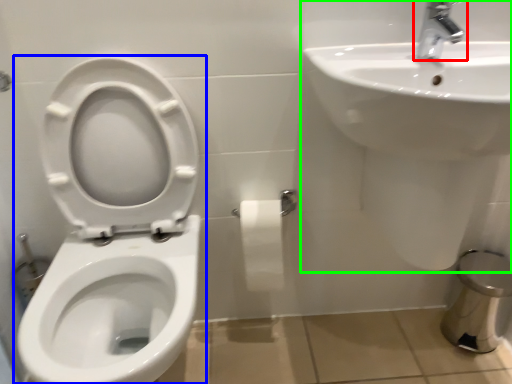
Question: Estimate the real-world distances between objects in this image. Which object is closer to tap (highlighted by a red box), toilet (highlighted by a blue box) or sink (highlighted by a green box)?

Choices:
 (A) toilet
 (B) sink

Answer: (B)